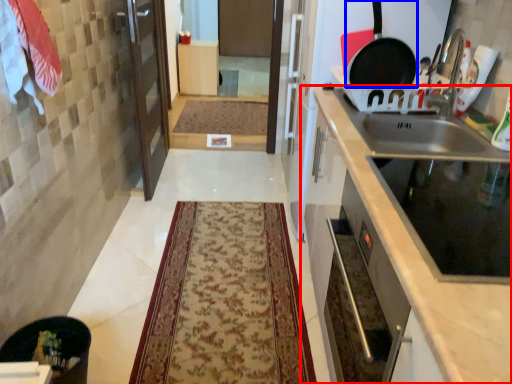
Question: Which object appears farthest to the camera in this image, cabinetry (highlighted by a red box) or frying pan (highlighted by a blue box)?

Choices:
 (A) cabinetry
 (B) frying pan

Answer: (B)